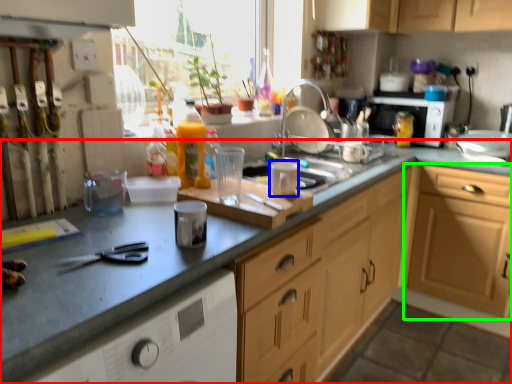
Question: Which is nearer to the countertop (highlighted by a red box)? appliance (highlighted by a blue box) or cabinetry (highlighted by a green box).

Choices:
 (A) appliance
 (B) cabinetry

Answer: (A)